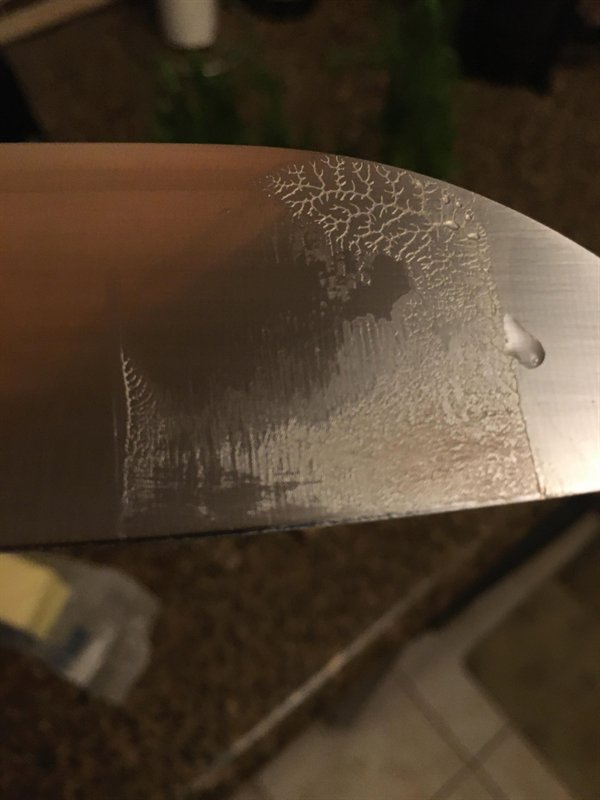
What are the coordinates of `cabinet` in the screenshot? It's located at (322, 590).